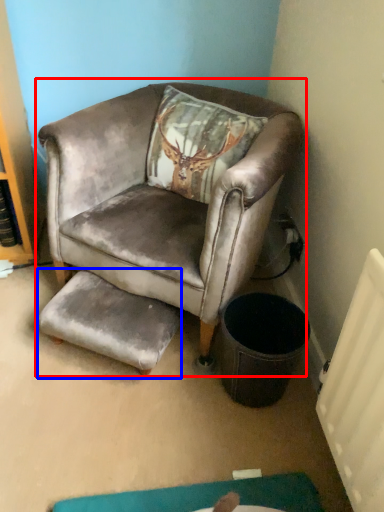
Question: Among these objects, which one is nearest to the camera, chair (highlighted by a red box) or footrest (highlighted by a blue box)?

Choices:
 (A) chair
 (B) footrest

Answer: (A)